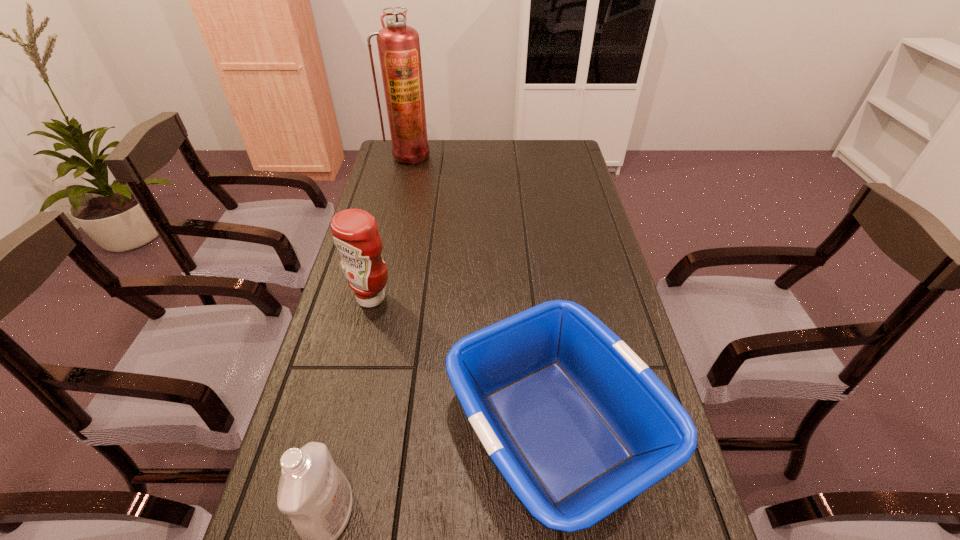
Locate an element on the screen. free region at the left edge of the desktop is located at coordinates (312, 395).

Locate an element on the screen. This screenshot has height=540, width=960. vacant space at the right edge of the desktop is located at coordinates (543, 183).

The image size is (960, 540). I want to click on vacant position at the far left corner of the desktop, so click(421, 168).

Find the location of a particular element. free space at the far right corner of the desktop is located at coordinates (554, 143).

Locate an element on the screen. The width and height of the screenshot is (960, 540). free point between the condiment and the fire extinguisher is located at coordinates (390, 226).

Locate an element on the screen. The image size is (960, 540). free space that is in between the farthest object and the third nearest object is located at coordinates (390, 226).

Identify which object is the third nearest to the tallest object. Please provide its 2D coordinates. Your answer should be formatted as a tuple, i.e. [(x, y)], where the tuple contains the x and y coordinates of a point satisfying the conditions above.

[(316, 495)]

Where is `the closest object to the farthest object`? The image size is (960, 540). the closest object to the farthest object is located at coordinates (355, 233).